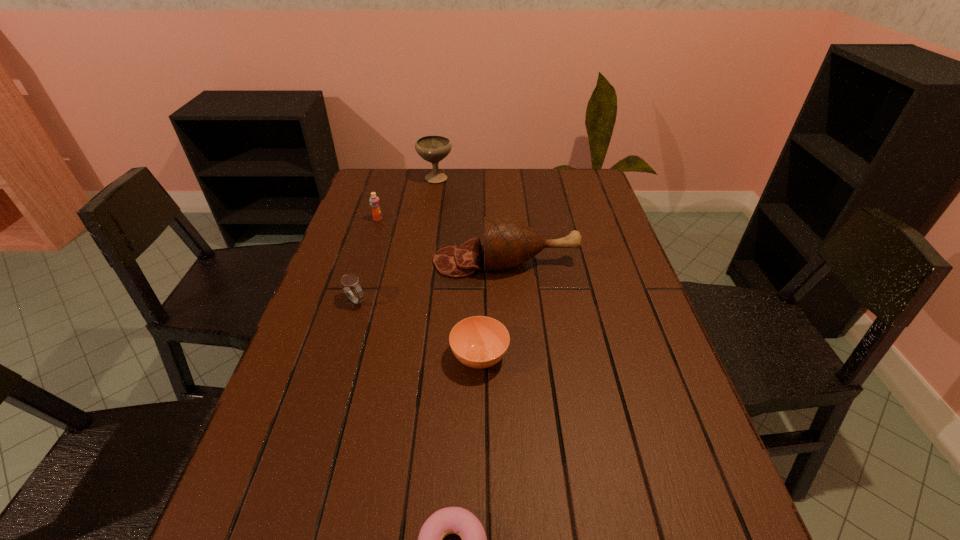
At what (x,y) coordinates should I click in order to perform the action: click on vacant area at the far left corner of the desktop. Please return your answer as a coordinate pair (x, y). This screenshot has height=540, width=960. Looking at the image, I should click on (372, 179).

Identify the location of vacant region at the far right corner of the desktop. The width and height of the screenshot is (960, 540). (578, 177).

Locate an element on the screen. This screenshot has width=960, height=540. free space between the chalice and the watch is located at coordinates (396, 239).

Identify the location of vacant region between the chalice and the watch. (396, 239).

What are the coordinates of `vacant region between the fifth nearest object and the fourth nearest object` in the screenshot? It's located at (442, 240).

Image resolution: width=960 pixels, height=540 pixels. In order to click on free point between the third farthest object and the third nearest object in this screenshot , I will do `click(430, 281)`.

Find the location of a particular element. object that ranks as the fifth closest to the fifth farthest object is located at coordinates (433, 148).

This screenshot has width=960, height=540. In order to click on the closest object relative to the soup bowl in this screenshot , I will do `click(508, 243)`.

Where is `free space that satisfies the following two spatial constraints: 1. on the front side of the orange juice; 2. on the right side of the second nearest object`? free space that satisfies the following two spatial constraints: 1. on the front side of the orange juice; 2. on the right side of the second nearest object is located at coordinates (335, 357).